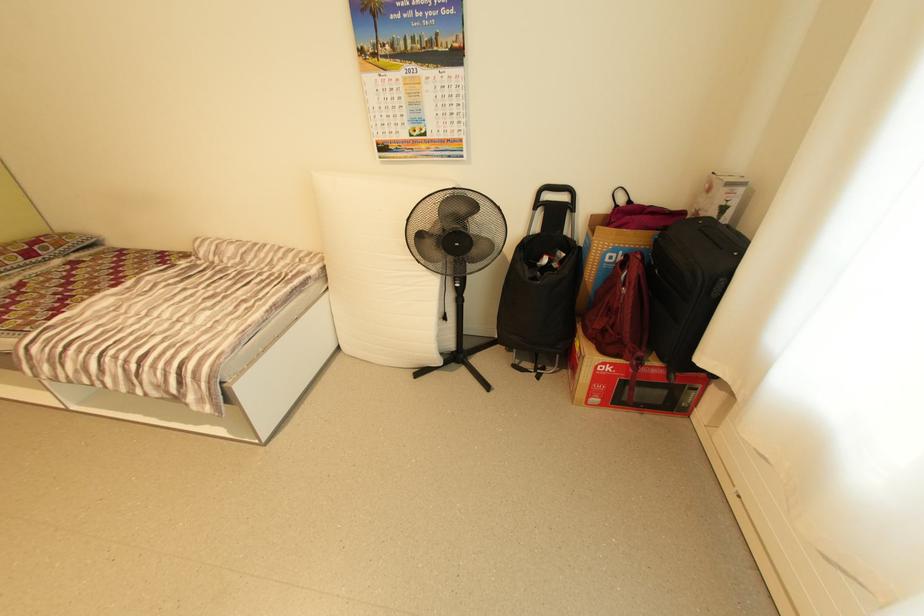
You are a GUI agent. You are given a task and a screenshot of the screen. Output one action in this format:
    pyautogui.click(x=<x>, y=<y>)
    Task: Click on the black trolley handle
    The height and width of the screenshot is (616, 924).
    Given the screenshot: What is the action you would take?
    pyautogui.click(x=555, y=193)